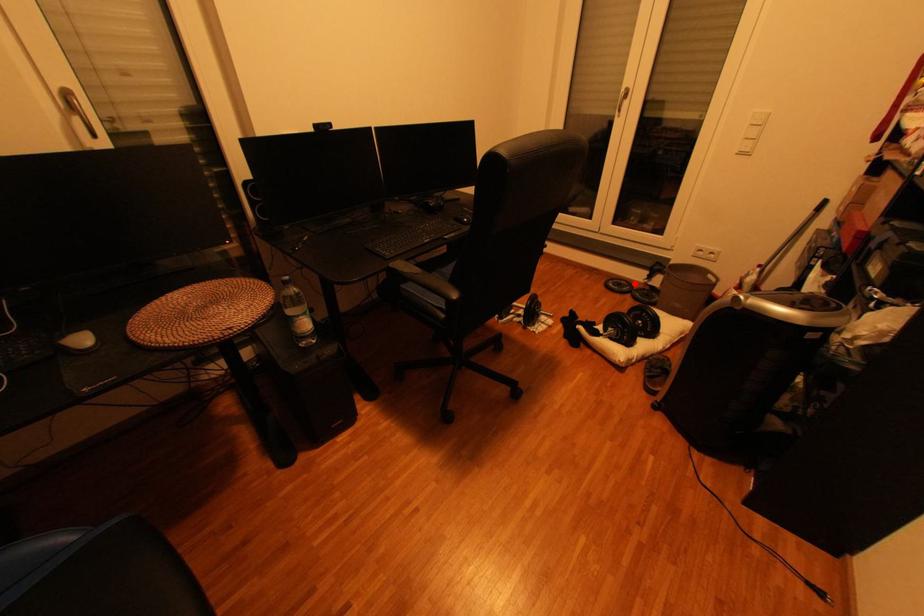
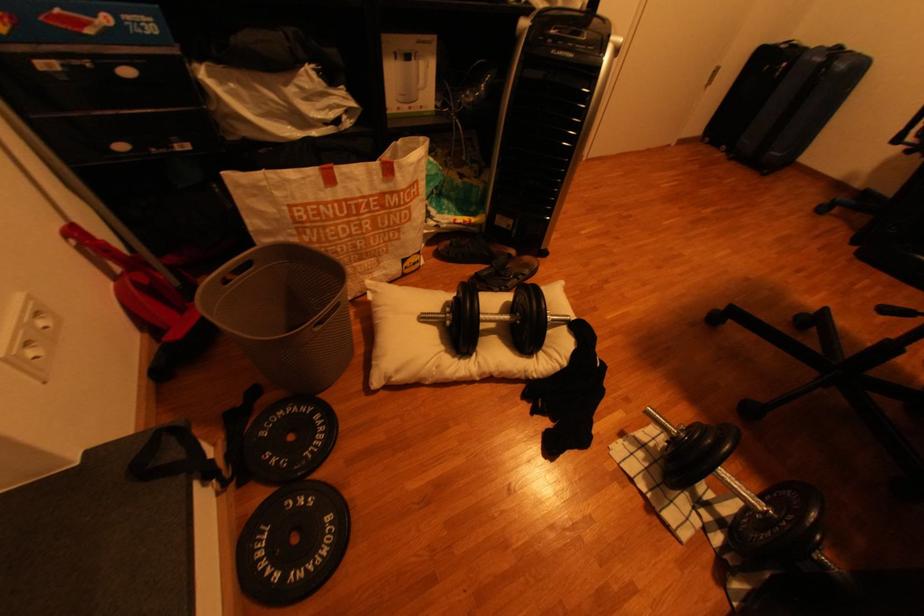
Find the pixel in the second image that matches the highlighted location in the first image.

(274, 540)